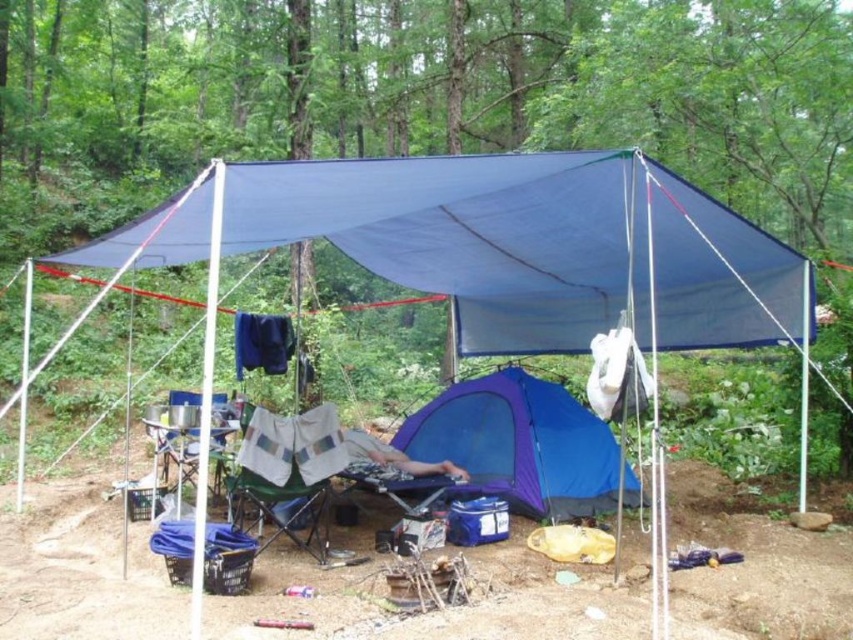
Which is behind, point (515, 189) or point (572, 477)?

The point (572, 477) is behind.

Identify the location of blue fabric tent at center. This screenshot has height=640, width=853. (494, 248).

Is point (199, 540) less distant than point (509, 445)?

That is True.

The image size is (853, 640). Find the location of `blue fabric tent at center`. blue fabric tent at center is located at coordinates (494, 248).